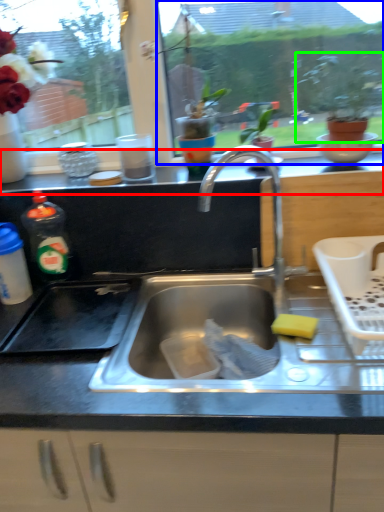
Question: Which is farther away from counter top (highlighted by a red box)? window screen (highlighted by a blue box) or houseplant (highlighted by a green box)?

Choices:
 (A) window screen
 (B) houseplant

Answer: (A)